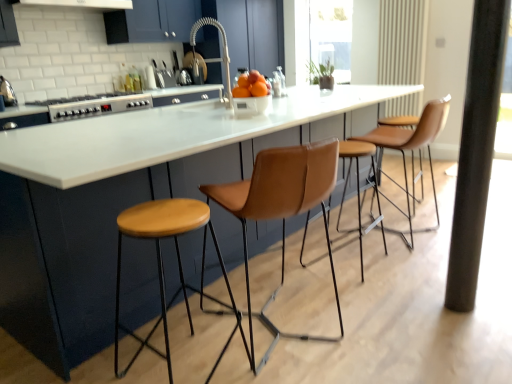
This screenshot has width=512, height=384. I want to click on unoccupied space behind black matte pillar at right, so click(430, 281).